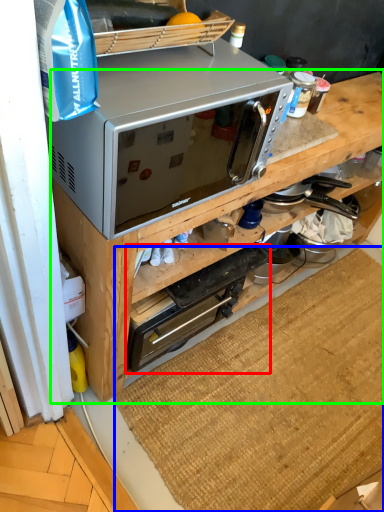
Question: Which object is positioned closest to appliance (highlighted by a red box)? Select from doormat (highlighted by a blue box) and cabinetry (highlighted by a green box).

Choices:
 (A) doormat
 (B) cabinetry

Answer: (B)